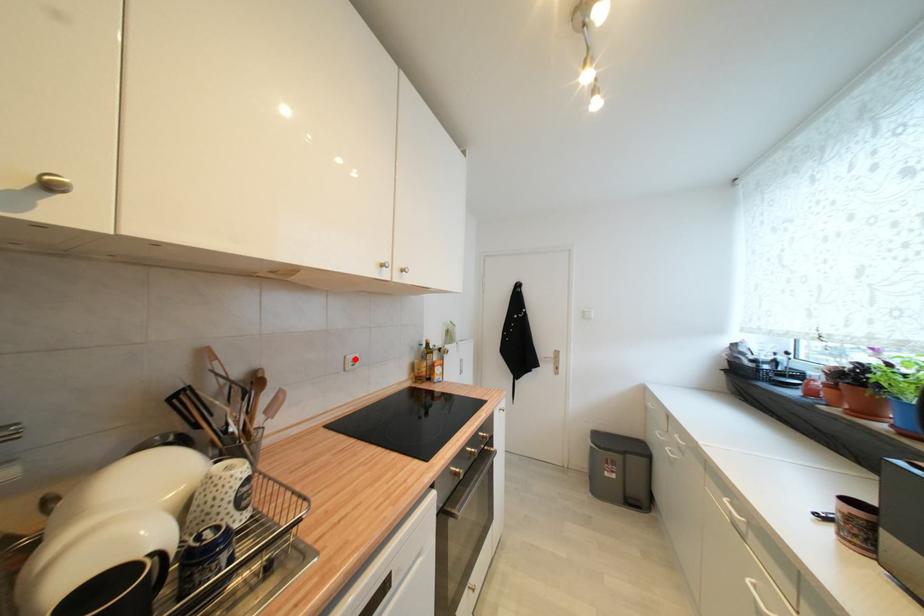
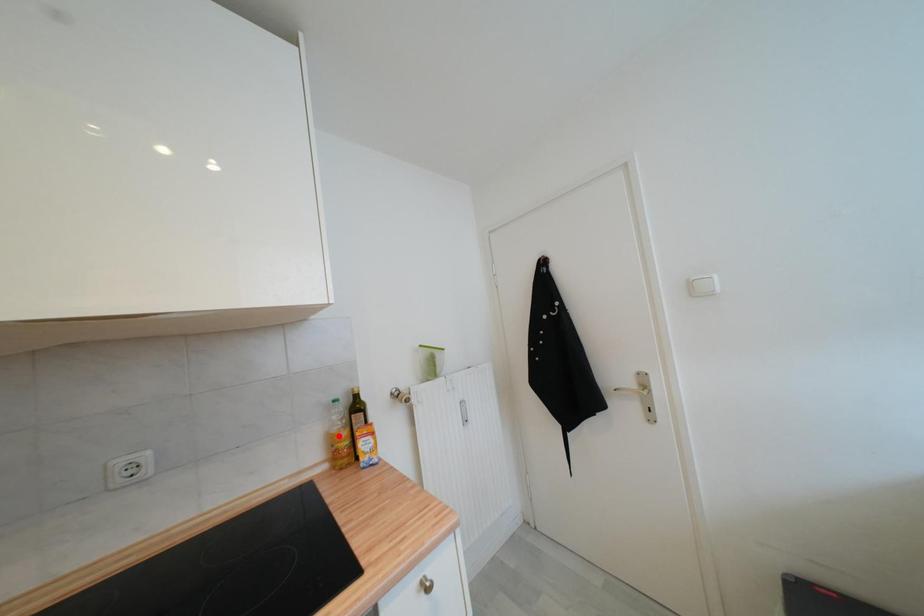
I am providing you with two images of the same scene from different viewpoints. A red point is marked on the first image and another point is marked on the second image. Do the highlighted points in image1 and image2 indicate the same real-world spot?

No